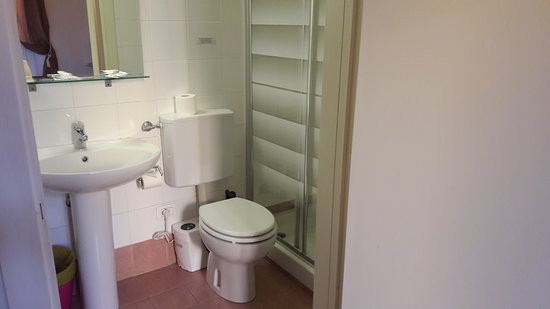
Find the location of `soap packets`. soap packets is located at coordinates (110, 71).